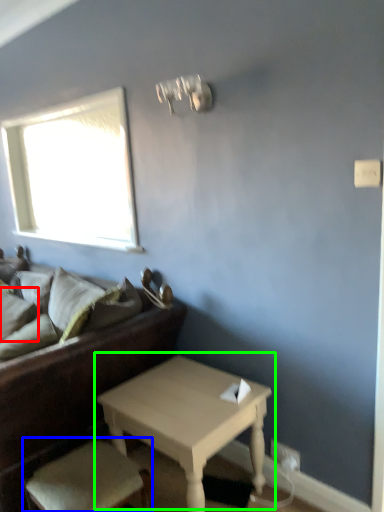
Question: Which is farther away from pillow (highlighted by a red box)? armchair (highlighted by a blue box) or table (highlighted by a green box)?

Choices:
 (A) armchair
 (B) table

Answer: (B)